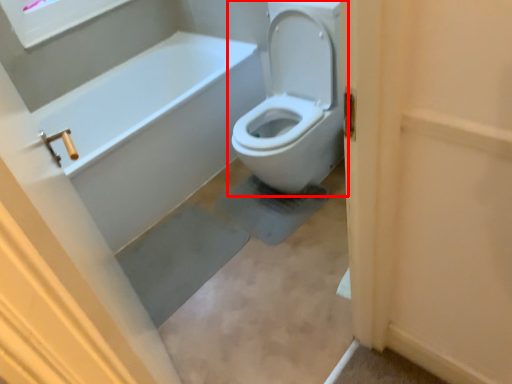
Question: Where is toilet (annotated by the red box) located in relation to screen door in the image?

Choices:
 (A) right
 (B) left

Answer: (B)